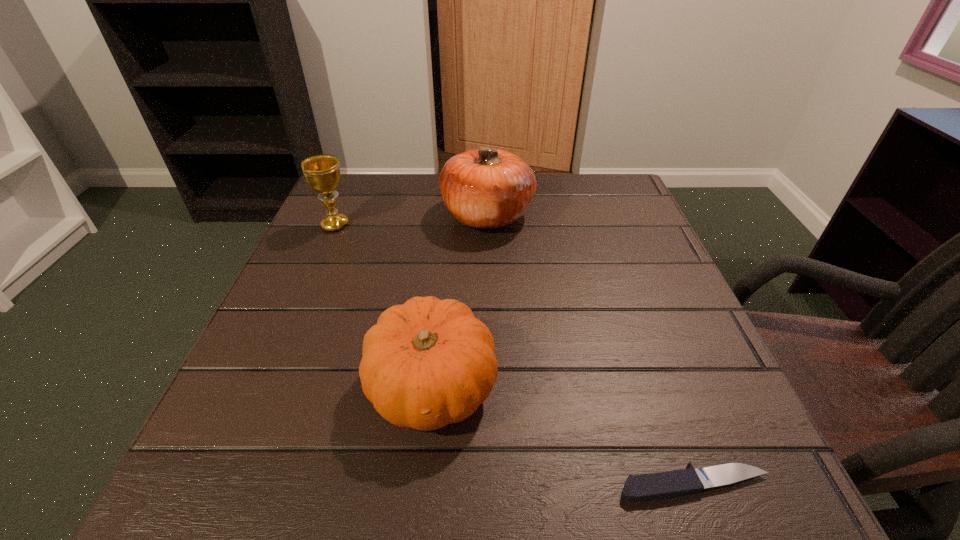
In order to click on vacant area between the steak knife and the second nearest object in this screenshot , I will do `click(564, 435)`.

You are a GUI agent. You are given a task and a screenshot of the screen. Output one action in this format:
    pyautogui.click(x=<x>, y=<y>)
    Task: Click on the free space between the leftmost object and the shortest object
    Image resolution: width=960 pixels, height=540 pixels.
    Given the screenshot: What is the action you would take?
    pyautogui.click(x=515, y=355)

The image size is (960, 540). I want to click on unoccupied area between the shorter pumpkin and the farther pumpkin, so click(x=460, y=300).

Identify which object is the second closest to the nearest object. Please provide its 2D coordinates. Your answer should be formatted as a tuple, i.e. [(x, y)], where the tuple contains the x and y coordinates of a point satisfying the conditions above.

[(487, 188)]

Find the location of a particular element. The width and height of the screenshot is (960, 540). object that is the third closest one to the rightmost object is located at coordinates (322, 174).

Where is `vacant space that satisfies the following two spatial constraints: 1. on the front side of the second nearest object; 2. on the right side of the leftmost object`? vacant space that satisfies the following two spatial constraints: 1. on the front side of the second nearest object; 2. on the right side of the leftmost object is located at coordinates click(265, 386).

The image size is (960, 540). Identify the location of free location that satisfies the following two spatial constraints: 1. on the front side of the shortest object; 2. on the left side of the third tallest object. (423, 484).

Where is `free space that satisfies the following two spatial constraints: 1. on the front side of the chalice; 2. on the left side of the steak knife`? Image resolution: width=960 pixels, height=540 pixels. free space that satisfies the following two spatial constraints: 1. on the front side of the chalice; 2. on the left side of the steak knife is located at coordinates (223, 484).